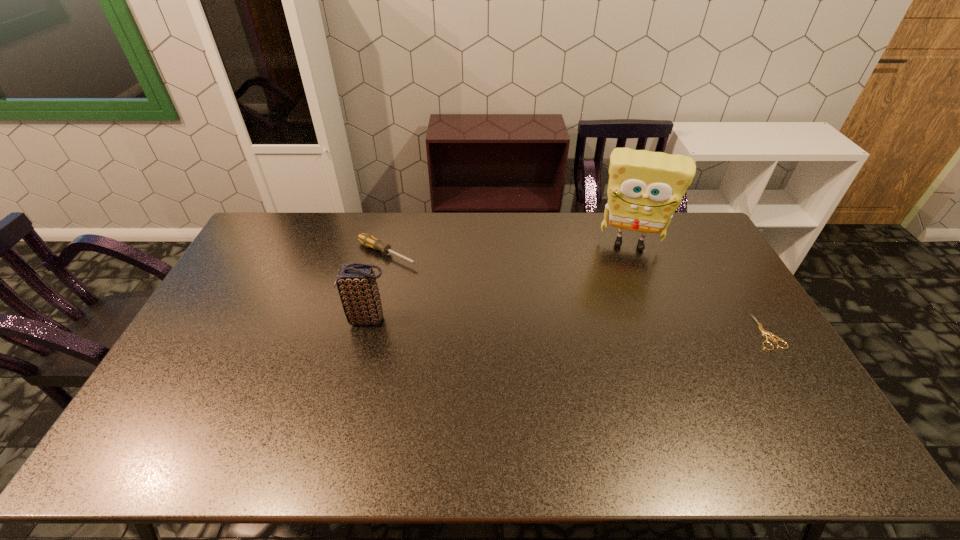
Locate an element on the screen. free spot at the near edge of the desktop is located at coordinates coord(346,411).

This screenshot has width=960, height=540. Find the location of `vacant space at the left edge of the desktop`. vacant space at the left edge of the desktop is located at coordinates (227, 288).

What are the coordinates of `free region at the right edge of the desktop` in the screenshot? It's located at (693, 267).

In the image, there is a desktop. At what (x,y) coordinates should I click in order to perform the action: click on vacant space at the far left corner. Please return your answer as a coordinate pair (x, y). The width and height of the screenshot is (960, 540). Looking at the image, I should click on (277, 224).

At what (x,y) coordinates should I click in order to perform the action: click on vacant point located between the clutch bag and the shears. Please return your answer as a coordinate pair (x, y). The width and height of the screenshot is (960, 540). Looking at the image, I should click on (567, 326).

At what (x,y) coordinates should I click in order to perform the action: click on vacant space in between the tallest object and the shears. Please return your answer as a coordinate pair (x, y). The height and width of the screenshot is (540, 960). Looking at the image, I should click on (698, 287).

Find the location of a particular element. The image size is (960, 540). free space between the shortest object and the third tallest object is located at coordinates (577, 293).

The height and width of the screenshot is (540, 960). Find the location of `free space between the clutch bag and the sponge`. free space between the clutch bag and the sponge is located at coordinates (498, 281).

Identify the location of free space between the screwdriver and the sponge. The width and height of the screenshot is (960, 540). (508, 248).

Identify the location of free spot between the sponge and the screwdriver. (508, 248).